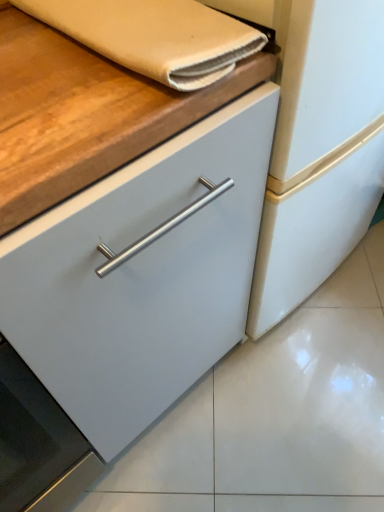
Identify the location of beige fabric hand towel at upper left. (154, 36).

This screenshot has height=512, width=384. Describe the element at coordinates (154, 36) in the screenshot. I see `beige fabric hand towel at upper left` at that location.

The image size is (384, 512). Find the location of `black glass oven at lower left`. black glass oven at lower left is located at coordinates (38, 444).

What do you see at coordinates (38, 444) in the screenshot? This screenshot has height=512, width=384. I see `black glass oven at lower left` at bounding box center [38, 444].

Where is `beige fabric hand towel at upper left`? This screenshot has width=384, height=512. beige fabric hand towel at upper left is located at coordinates (154, 36).

Would you say beige fabric hand towel at upper left is to the left or to the right of black glass oven at lower left in the picture?

Based on their positions, beige fabric hand towel at upper left is located to the right of black glass oven at lower left.

Relative to black glass oven at lower left, is beige fabric hand towel at upper left in front or behind?

Clearly, beige fabric hand towel at upper left is behind black glass oven at lower left.

Does point (126, 10) lie in front of point (19, 464)?

That is True.

In the scene shown: From the image's perspective, who appears lower, beige fabric hand towel at upper left or black glass oven at lower left?

black glass oven at lower left is shown below in the image.

From a real-world perspective, which object stands above the other?

beige fabric hand towel at upper left is physically above.

Looking at this image, which of these two, beige fabric hand towel at upper left or black glass oven at lower left, is thinner?

Thinner between the two is beige fabric hand towel at upper left.

From their relative heights in the image, would you say beige fabric hand towel at upper left is taller or shorter than black glass oven at lower left?

beige fabric hand towel at upper left is shorter than black glass oven at lower left.

Between beige fabric hand towel at upper left and black glass oven at lower left, which one has larger size?

With larger size is black glass oven at lower left.

Could black glass oven at lower left be considered to be inside beige fabric hand towel at upper left?

Actually, black glass oven at lower left is outside beige fabric hand towel at upper left.

Is beige fabric hand towel at upper left not close to black glass oven at lower left?

beige fabric hand towel at upper left is actually quite close to black glass oven at lower left.

Is beige fabric hand towel at upper left positioned with its back to black glass oven at lower left?

No.

Can you tell me how much beige fabric hand towel at upper left and black glass oven at lower left differ in facing direction?

The angular difference between beige fabric hand towel at upper left and black glass oven at lower left is 91 degrees.

Locate an element on the screen. oven to the left of beige fabric hand towel at upper left is located at coordinates (38, 444).

Which is more to the left, black glass oven at lower left or beige fabric hand towel at upper left?

Positioned to the left is black glass oven at lower left.

Relative to beige fabric hand towel at upper left, is black glass oven at lower left in front or behind?

Visually, black glass oven at lower left is located in front of beige fabric hand towel at upper left.

Between point (66, 497) and point (189, 65), which one is positioned in front?

The point (189, 65) is in front.

From the image's perspective, would you say black glass oven at lower left is positioned over beige fabric hand towel at upper left?

No.

From a real-world perspective, is black glass oven at lower left under beige fabric hand towel at upper left?

Yes, from a real-world perspective, black glass oven at lower left is beneath beige fabric hand towel at upper left.

Which object is thinner, black glass oven at lower left or beige fabric hand towel at upper left?

Thinner between the two is beige fabric hand towel at upper left.

Based on the photo, who is taller, black glass oven at lower left or beige fabric hand towel at upper left?

Standing taller between the two is black glass oven at lower left.

Considering the relative sizes of black glass oven at lower left and beige fabric hand towel at upper left in the image provided, is black glass oven at lower left smaller than beige fabric hand towel at upper left?

Incorrect, black glass oven at lower left is not smaller in size than beige fabric hand towel at upper left.

Is black glass oven at lower left inside or outside of beige fabric hand towel at upper left?

black glass oven at lower left exists outside the volume of beige fabric hand towel at upper left.

Is black glass oven at lower left positioned far away from beige fabric hand towel at upper left?

Actually, black glass oven at lower left and beige fabric hand towel at upper left are a little close together.

Is black glass oven at lower left facing towards beige fabric hand towel at upper left?

No, black glass oven at lower left is not turned towards beige fabric hand towel at upper left.

In order to click on oven that appears on the left of beige fabric hand towel at upper left in this screenshot , I will do `click(38, 444)`.

Find the location of a particular element. hand towel above the black glass oven at lower left (from a real-world perspective) is located at coordinates (154, 36).

This screenshot has width=384, height=512. In order to click on oven below the beige fabric hand towel at upper left (from a real-world perspective) in this screenshot , I will do tap(38, 444).